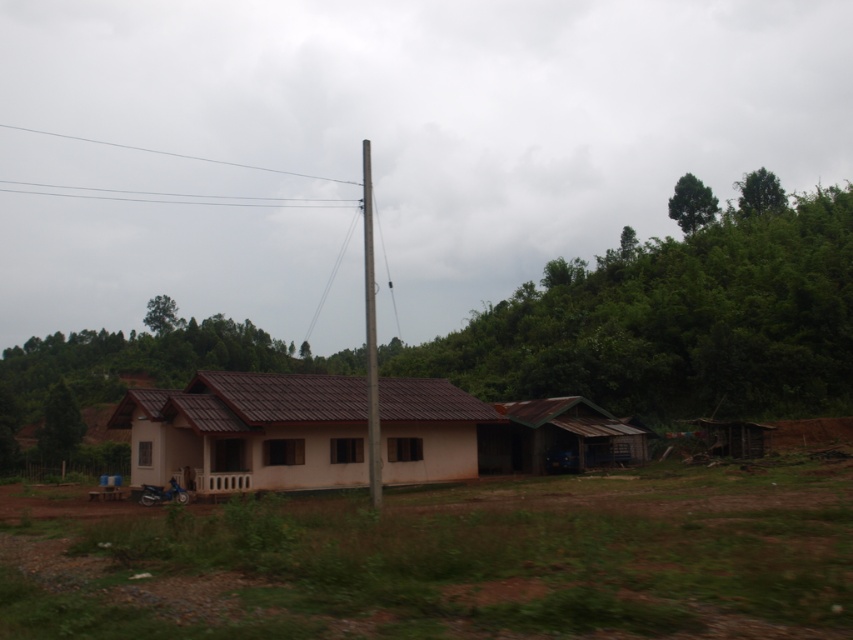
What do you see at coordinates (248, 432) in the screenshot?
I see `brown matte house at center` at bounding box center [248, 432].

Can you confirm if brown matte house at center is positioned to the left of metallic pole at center?

Incorrect, brown matte house at center is not on the left side of metallic pole at center.

The height and width of the screenshot is (640, 853). What do you see at coordinates (248, 432) in the screenshot?
I see `brown matte house at center` at bounding box center [248, 432].

The image size is (853, 640). I want to click on brown matte house at center, so [248, 432].

Between brown matte house at center and rusty corrugated tin hut at lower right, which one appears on the left side from the viewer's perspective?

brown matte house at center

Based on the photo, is brown matte house at center thinner than rusty corrugated tin hut at lower right?

No.

Identify the location of brown matte house at center. (248, 432).

Which of these two, rusty corrugated tin hut at lower right or metallic pole at center, stands shorter?

With less height is rusty corrugated tin hut at lower right.

Does rusty corrugated tin hut at lower right appear under metallic pole at center?

Correct, rusty corrugated tin hut at lower right is located below metallic pole at center.

This screenshot has height=640, width=853. What are the coordinates of `rusty corrugated tin hut at lower right` in the screenshot? It's located at (560, 436).

Where is `rusty corrugated tin hut at lower right`? This screenshot has height=640, width=853. rusty corrugated tin hut at lower right is located at coordinates (560, 436).